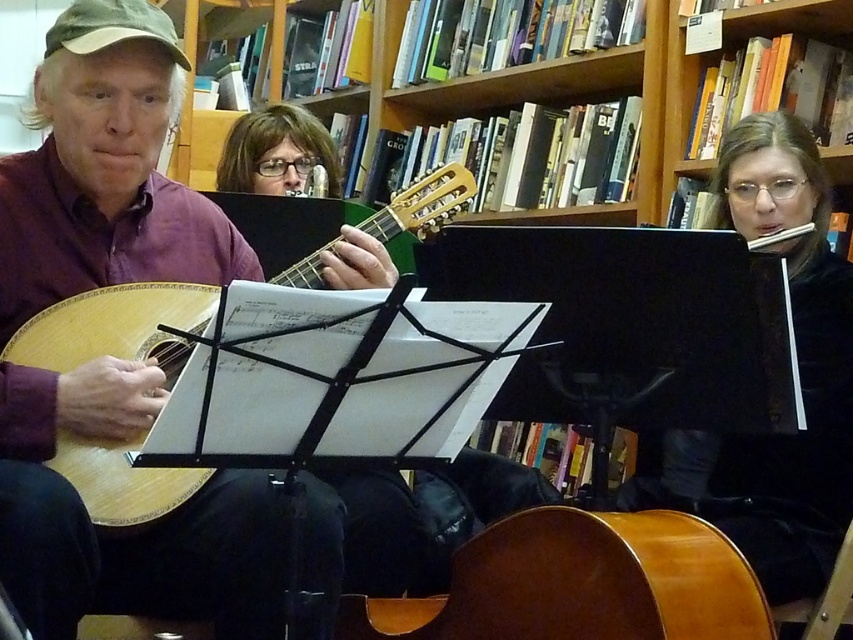
How much distance is there between black velvet dress at center and shiny brown cello at lower center?

They are 17.54 inches apart.

What are the coordinates of `black velvet dress at center` in the screenshot? It's located at (799, 380).

Does matte wood guitar at left have a greater height compared to shiny brown cello at lower center?

Indeed, matte wood guitar at left has a greater height compared to shiny brown cello at lower center.

Can you confirm if matte wood guitar at left is positioned to the right of shiny brown cello at lower center?

Incorrect, matte wood guitar at left is not on the right side of shiny brown cello at lower center.

Does point (103, 179) lie behind point (534, 618)?

Yes, point (103, 179) is behind point (534, 618).

Identify the location of matte wood guitar at left. The width and height of the screenshot is (853, 640). (105, 172).

In the scene shown: Can you confirm if matte wood guitar at left is shorter than black velvet dress at center?

Incorrect, matte wood guitar at left's height does not fall short of black velvet dress at center's.

Is matte wood guitar at left behind black velvet dress at center?

No, it is not.

Is point (39, 477) positioned after point (825, 358)?

No, it is not.

Find the location of a particular element. matte wood guitar at left is located at coordinates (105, 172).